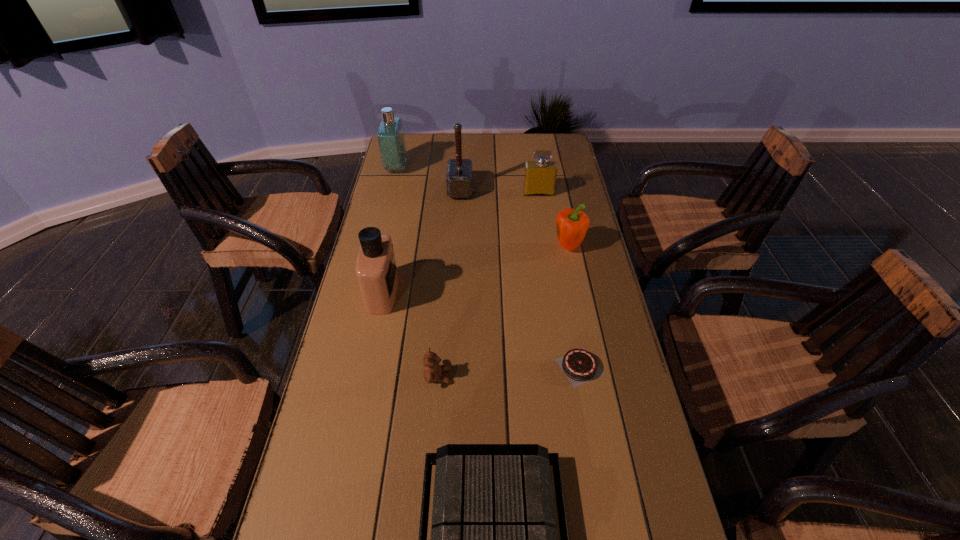
Identify the location of hammer. (459, 171).

In order to click on the farthest perfume in this screenshot , I will do `click(390, 135)`.

At what (x,y) coordinates should I click in order to perform the action: click on the nearest perfume. Please return your answer as a coordinate pair (x, y). The height and width of the screenshot is (540, 960). Looking at the image, I should click on (376, 270).

The image size is (960, 540). I want to click on the second nearest perfume, so click(540, 176).

You are a GUI agent. You are given a task and a screenshot of the screen. Output one action in this format:
    pyautogui.click(x=<x>, y=<y>)
    Task: Click on the shortest perfume
    The height and width of the screenshot is (540, 960).
    Given the screenshot: What is the action you would take?
    (x=540, y=176)

The height and width of the screenshot is (540, 960). I want to click on the fifth nearest object, so click(572, 225).

Identify the location of teddy bear. (432, 370).

You are a GUI agent. You are given a task and a screenshot of the screen. Output one action in this format:
    pyautogui.click(x=<x>, y=<y>)
    Task: Click on the shortest object
    The width and height of the screenshot is (960, 540).
    Given the screenshot: What is the action you would take?
    pyautogui.click(x=580, y=366)

Identify the location of blank area located 0.150m on the back of the hammer. (462, 158).

Image resolution: width=960 pixels, height=540 pixels. In order to click on vacant space positioned 0.300m on the front label of the farthest object in this screenshot , I will do `click(483, 168)`.